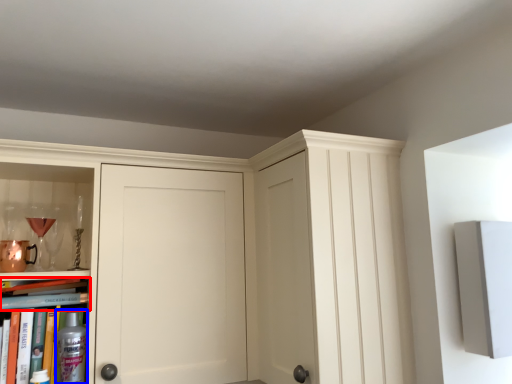
Question: Among these objects, which one is nearest to the camera, book (highlighted by a red box) or bottle (highlighted by a blue box)?

Choices:
 (A) book
 (B) bottle

Answer: (B)